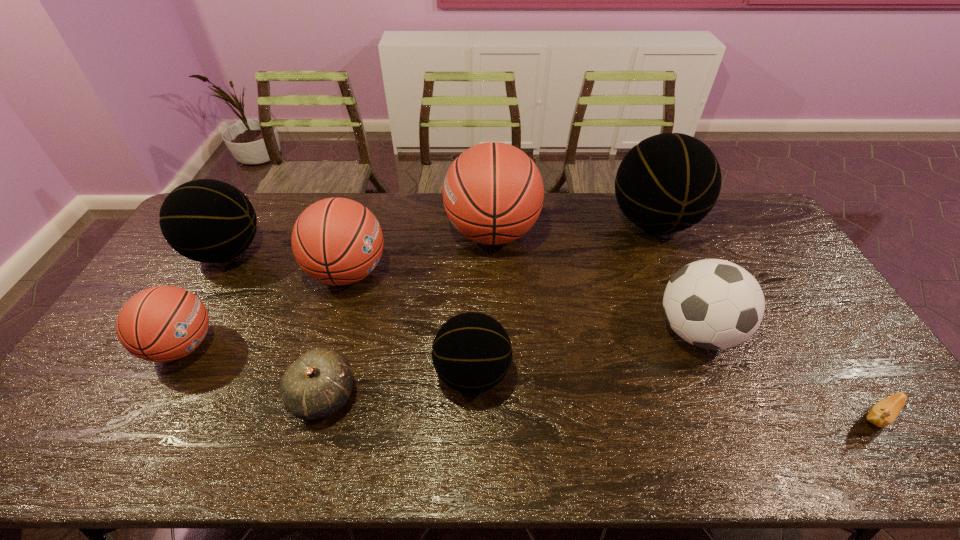
Where is `free space that satisfies the following two spatial constraints: 1. on the logo side of the gourd; 2. on the right side of the nearest orange basketball`? free space that satisfies the following two spatial constraints: 1. on the logo side of the gourd; 2. on the right side of the nearest orange basketball is located at coordinates (155, 395).

In order to click on free space that satisfies the following two spatial constraints: 1. on the logo side of the nearest orange basketball; 2. on the back side of the gourd in this screenshot , I will do `click(155, 395)`.

Find the location of a particular element. The height and width of the screenshot is (540, 960). free space that satisfies the following two spatial constraints: 1. on the logo side of the leftmost orange basketball; 2. on the right side of the banana is located at coordinates (142, 417).

Locate an element on the screen. Image resolution: width=960 pixels, height=540 pixels. free spot that satisfies the following two spatial constraints: 1. on the logo side of the second orange basketball from left to right; 2. on the left side of the gourd is located at coordinates (312, 395).